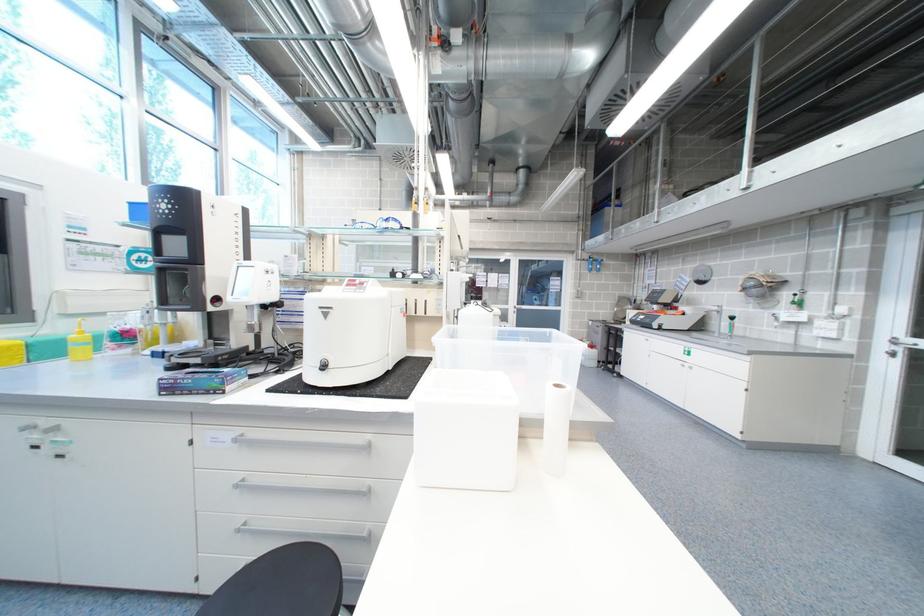
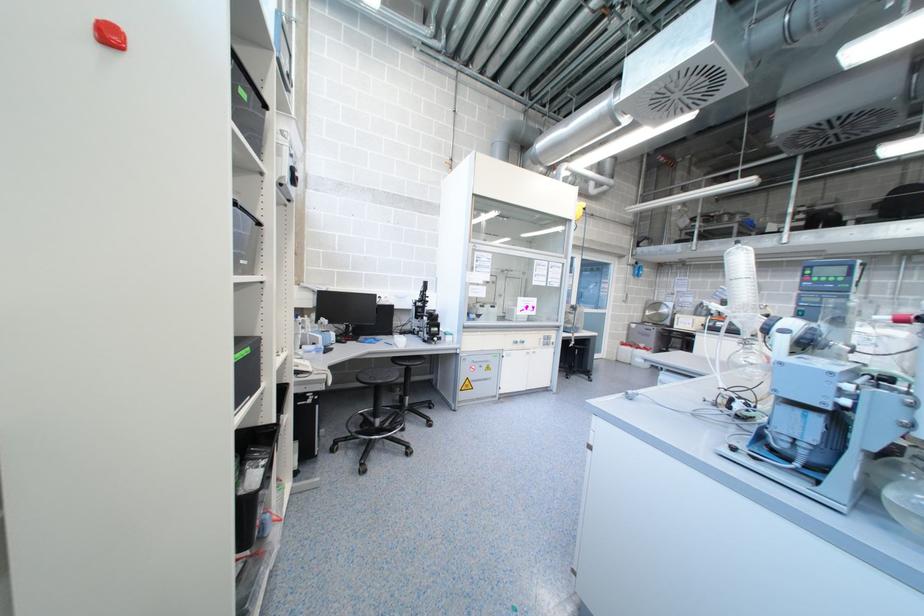
Which direction would the cameraman need to move to produce the second image?

The movement direction of the cameraman is left, forward.